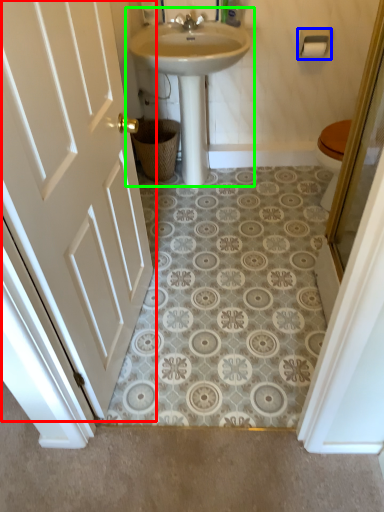
Question: Considering the real-world distances, which object is closest to door (highlighted by a red box)? towel bar (highlighted by a blue box) or sink (highlighted by a green box).

Choices:
 (A) towel bar
 (B) sink

Answer: (B)